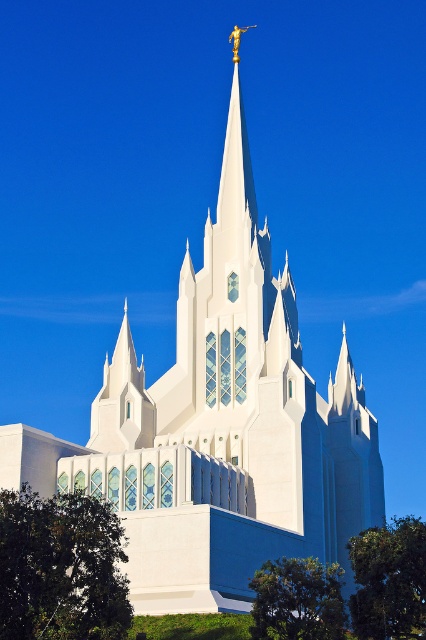
Question: Can you confirm if green leafy tree at lower left is positioned above green leafy tree at lower right?

Choices:
 (A) yes
 (B) no

Answer: (A)

Question: Is green leafy tree at lower right below green leafy tree at lower center?

Choices:
 (A) yes
 (B) no

Answer: (A)

Question: Which point is farther from the camera taking this photo?

Choices:
 (A) (302, 584)
 (B) (360, 625)

Answer: (A)

Question: Which of these objects is positioned closest to the green leafy tree at lower left?

Choices:
 (A) green leafy tree at lower right
 (B) green leafy tree at lower center

Answer: (B)

Question: Does green leafy tree at lower left have a greater width compared to green leafy tree at lower right?

Choices:
 (A) yes
 (B) no

Answer: (B)

Question: Which object is farther from the camera taking this photo?

Choices:
 (A) green leafy tree at lower right
 (B) green leafy tree at lower left
 (C) green leafy tree at lower center

Answer: (C)